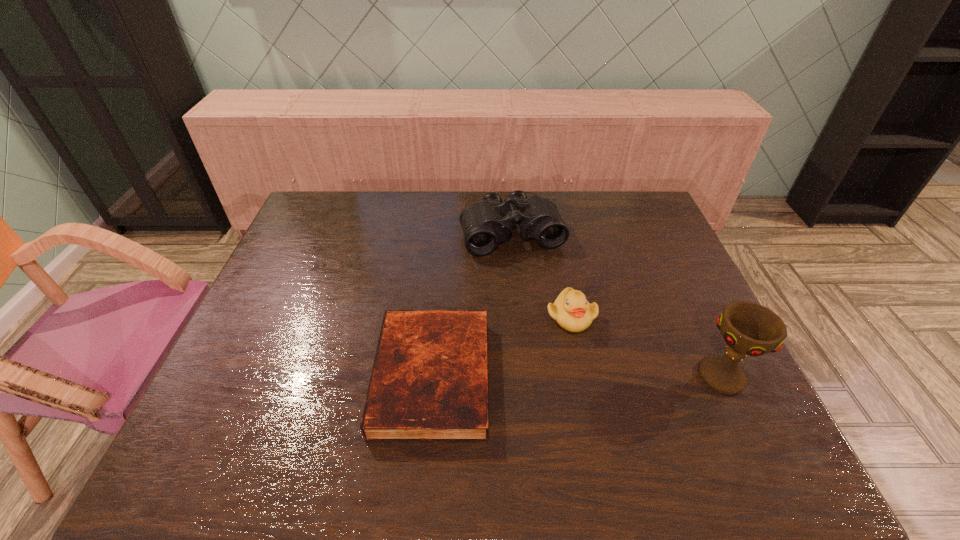
The image size is (960, 540). What are the coordinates of `the shortest object` in the screenshot? It's located at (429, 382).

The width and height of the screenshot is (960, 540). Find the location of `the tallest object`. the tallest object is located at coordinates (748, 328).

I want to click on chalice, so click(748, 328).

Where is `the farthest object`? This screenshot has width=960, height=540. the farthest object is located at coordinates (485, 224).

Find the location of `the second tallest object`. the second tallest object is located at coordinates (485, 224).

The image size is (960, 540). I want to click on the third tallest object, so click(571, 310).

Image resolution: width=960 pixels, height=540 pixels. I want to click on vacant space located 0.340m on the spine side of the shortest object, so click(231, 376).

Where is `vacant area situated 0.230m on the spine side of the shortest object`? The width and height of the screenshot is (960, 540). vacant area situated 0.230m on the spine side of the shortest object is located at coordinates (278, 376).

The height and width of the screenshot is (540, 960). I want to click on vacant space located on the spine side of the shortest object, so click(x=322, y=376).

Find the location of a particular element. vacant position located 0.190m on the left of the rightmost object is located at coordinates (614, 376).